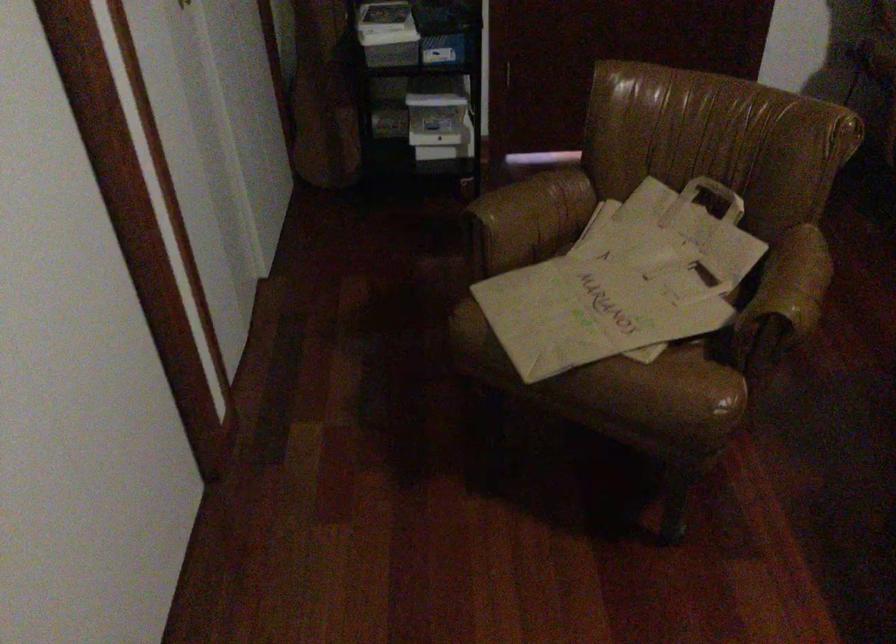
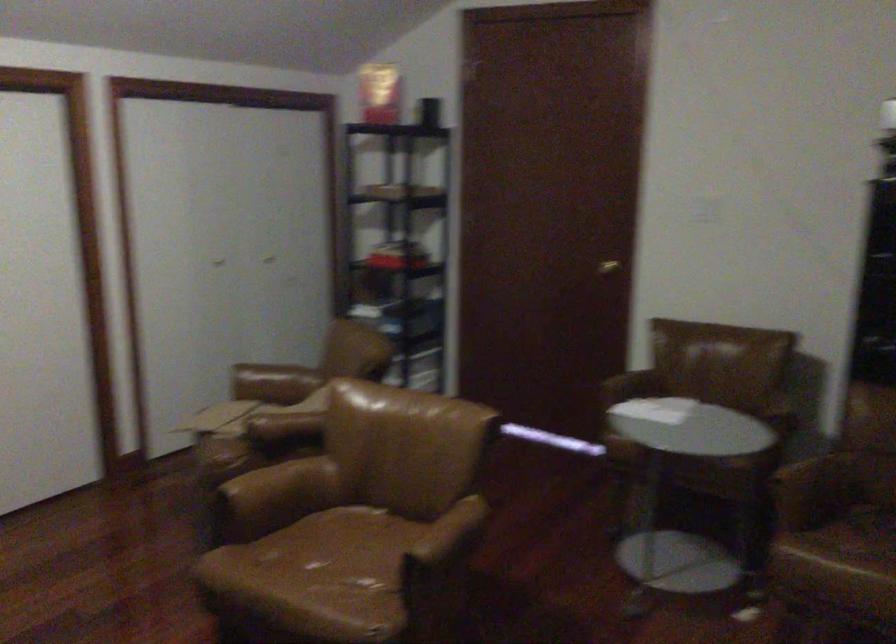
Where in the second image is the point corresponding to (505,218) from the first image?

(273, 383)